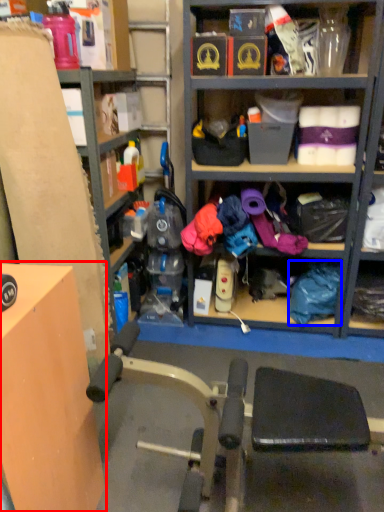
Question: Which of the following is the farthest to the observer, table (highlighted by a red box) or clothing (highlighted by a blue box)?

Choices:
 (A) table
 (B) clothing

Answer: (B)